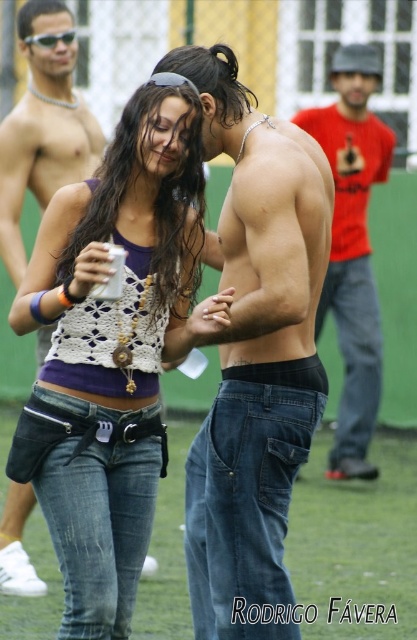
Does denim jeans at center come behind matte red shirt at right?

No, denim jeans at center is in front of matte red shirt at right.

Is point (135, 445) behind point (367, 273)?

That is False.

This screenshot has height=640, width=417. What are the coordinates of `denim jeans at center` in the screenshot? It's located at (92, 500).

You are a GUI agent. You are given a task and a screenshot of the screen. Output one action in this format:
    pyautogui.click(x=<x>, y=<y>)
    Task: Click on the dark blue denim jeans at center
    
    Given the screenshot: What is the action you would take?
    pyautogui.click(x=246, y=500)

Does dark blue denim jeans at center appear under matte red shirt at right?

Yes, dark blue denim jeans at center is below matte red shirt at right.

Is point (190, 570) behind point (366, 406)?

That is False.

The width and height of the screenshot is (417, 640). I want to click on dark blue denim jeans at center, so click(x=246, y=500).